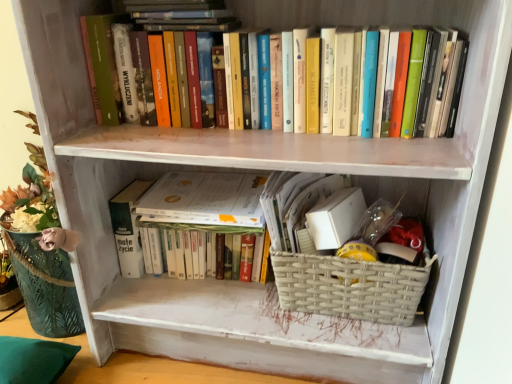
The image size is (512, 384). In order to click on free space above woven beige basket at lower center (from a real-world perspective) in this screenshot , I will do `click(364, 244)`.